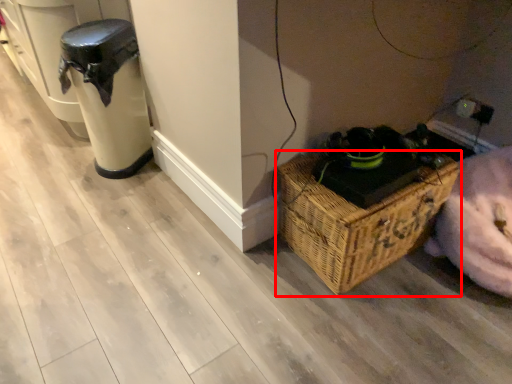
Question: From the image's perspective, considering the relative positions of picnic basket (annotated by the red box) and appliance in the image provided, where is picnic basket (annotated by the red box) located with respect to the staircase?

Choices:
 (A) above
 (B) below

Answer: (B)